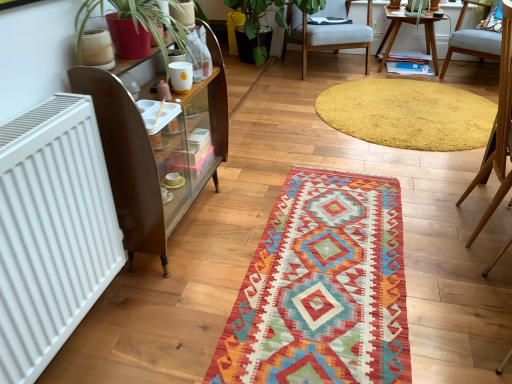
Where is `free space that is to the left of light blue fabric chair at right, the 2th chair from the left`? The height and width of the screenshot is (384, 512). free space that is to the left of light blue fabric chair at right, the 2th chair from the left is located at coordinates (425, 227).